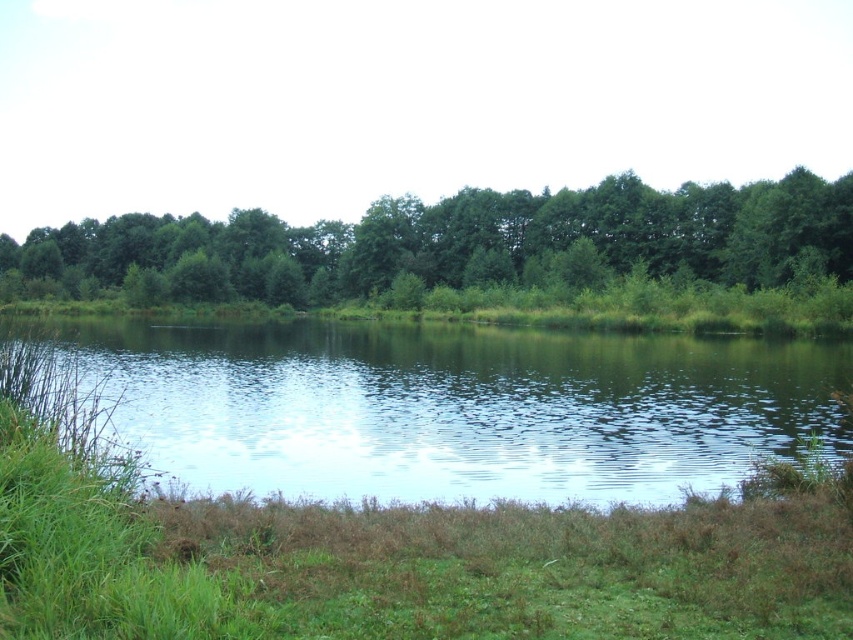
Question: Which object is positioned farthest from the green reflective water at center?

Choices:
 (A) green leafy trees at center
 (B) green grassy at lower center

Answer: (A)

Question: Among these objects, which one is farthest from the camera?

Choices:
 (A) green leafy trees at center
 (B) green reflective water at center
 (C) green grassy at lower center

Answer: (A)

Question: Where is green reflective water at center located in relation to green leafy trees at center in the image?

Choices:
 (A) below
 (B) above

Answer: (A)

Question: Which point appears farthest from the camera in this image?

Choices:
 (A) (289, 298)
 (B) (270, 572)

Answer: (A)

Question: Is green grassy at lower center to the left of green leafy trees at center from the viewer's perspective?

Choices:
 (A) no
 (B) yes

Answer: (A)

Question: Is green reflective water at center positioned at the back of green grassy at lower center?

Choices:
 (A) yes
 (B) no

Answer: (A)